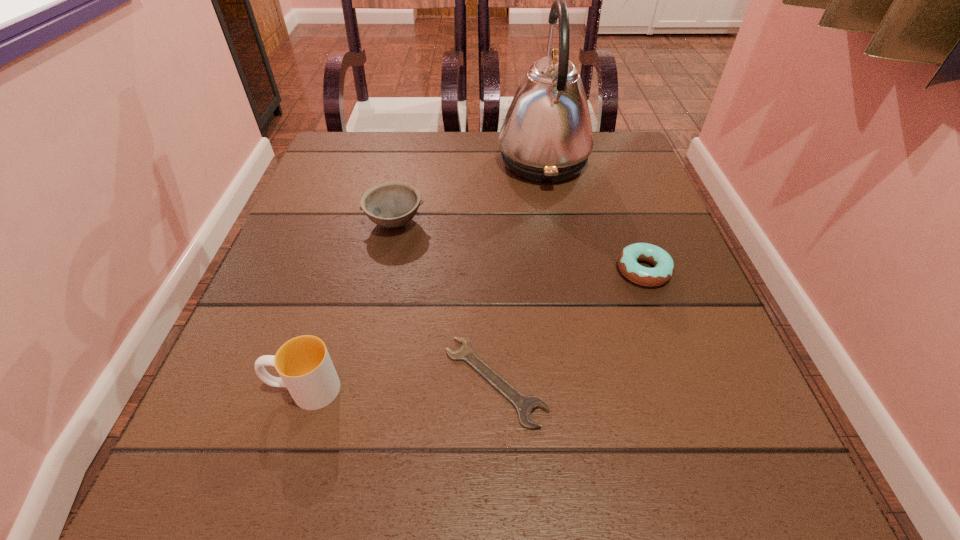
Find the location of a particular element. doughnut that is at the right edge is located at coordinates pyautogui.click(x=664, y=268).

In order to click on object that is at the far right corner in this screenshot , I will do `click(546, 137)`.

In the image, there is a desktop. Identify the location of vacant region at the far edge. The height and width of the screenshot is (540, 960). (507, 170).

Identify the location of blank space at the near edge of the desktop. Image resolution: width=960 pixels, height=540 pixels. (346, 514).

I want to click on vacant space at the left edge of the desktop, so coord(252,319).

The image size is (960, 540). In the image, there is a desktop. In order to click on vacant space at the right edge in this screenshot , I will do coord(594,185).

At what (x,y) coordinates should I click in order to perform the action: click on free space at the far left corner of the desktop. Please return your answer as a coordinate pair (x, y). The image size is (960, 540). Looking at the image, I should click on (343, 177).

The image size is (960, 540). I want to click on vacant space at the far right corner of the desktop, so click(617, 165).

The image size is (960, 540). I want to click on vacant region between the fourth shortest object and the fourth tallest object, so click(x=474, y=330).

This screenshot has height=540, width=960. I want to click on free space between the bowl and the cup, so click(x=349, y=306).